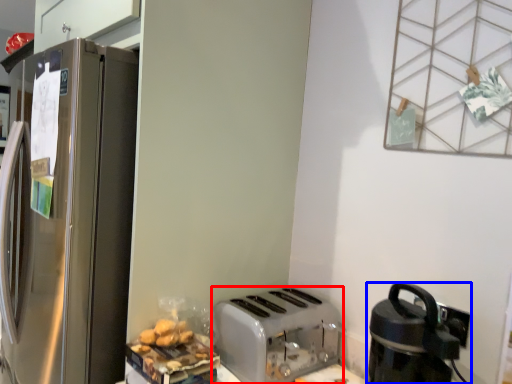
Question: Which object is further to the camera taking this photo, toaster (highlighted by a red box) or kitchen appliance (highlighted by a blue box)?

Choices:
 (A) toaster
 (B) kitchen appliance

Answer: (A)